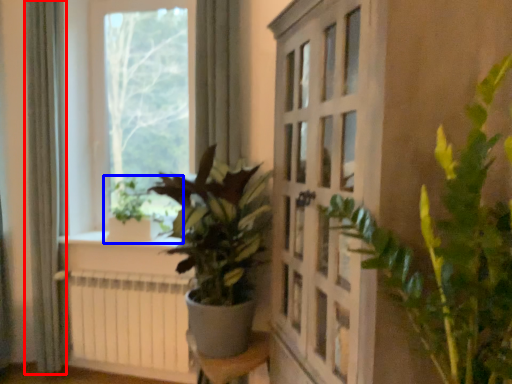
Question: Which point is closer to the camera, curtain (highlighted by a red box) or houseplant (highlighted by a blue box)?

Choices:
 (A) curtain
 (B) houseplant

Answer: (A)